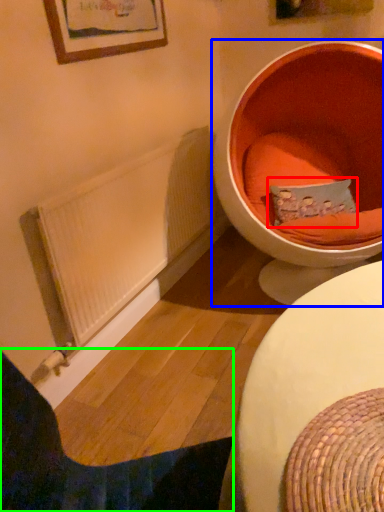
Question: Which object is the closest to the pillow (highlighted by a red box)? Choose among these: toilet (highlighted by a blue box) or furniture (highlighted by a green box).

Choices:
 (A) toilet
 (B) furniture

Answer: (A)